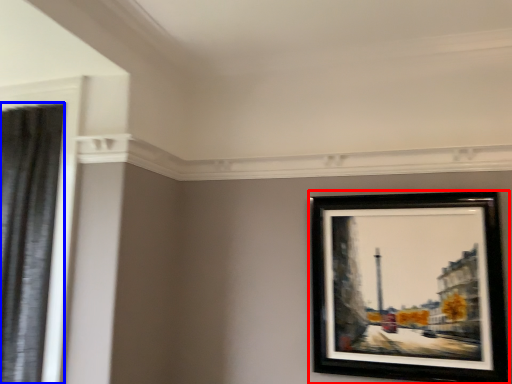
Question: Which object appears closest to the camera in this image, picture frame (highlighted by a red box) or shower curtain (highlighted by a blue box)?

Choices:
 (A) picture frame
 (B) shower curtain

Answer: (B)